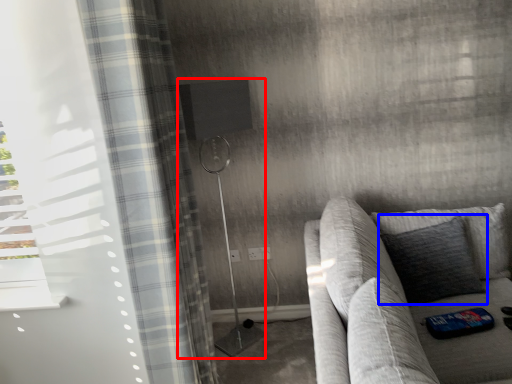
Question: Which of the following is the closest to the observer, shower (highlighted by a red box) or pillow (highlighted by a blue box)?

Choices:
 (A) shower
 (B) pillow

Answer: (B)